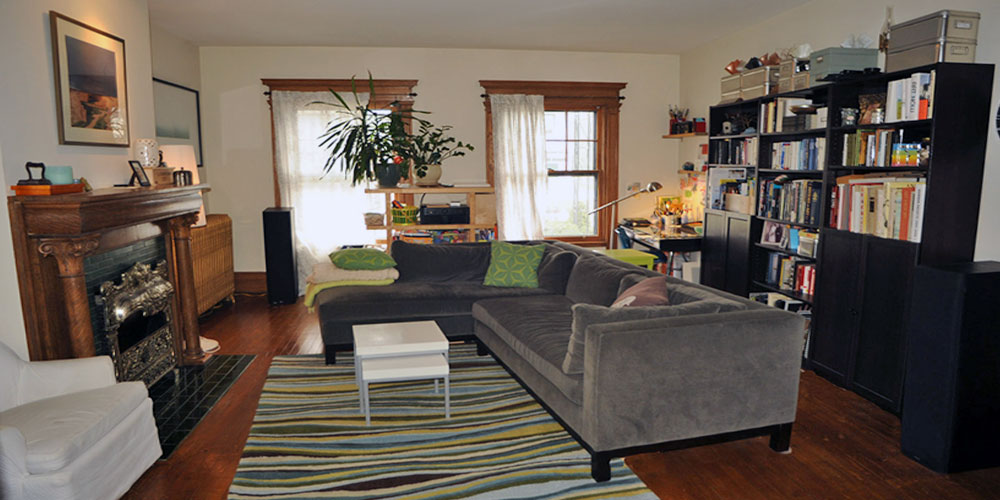
Identify the location of curtain. (516, 137).